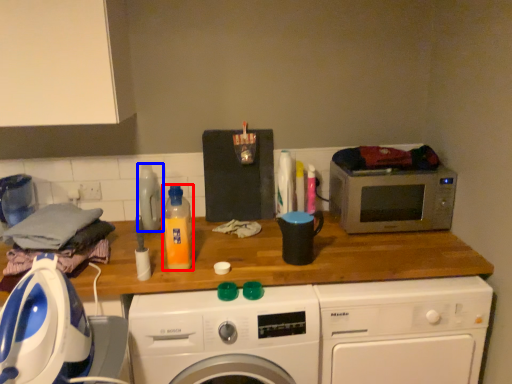
Question: Which point is further to the camera, bottle (highlighted by a red box) or bottle (highlighted by a blue box)?

Choices:
 (A) bottle
 (B) bottle

Answer: (B)